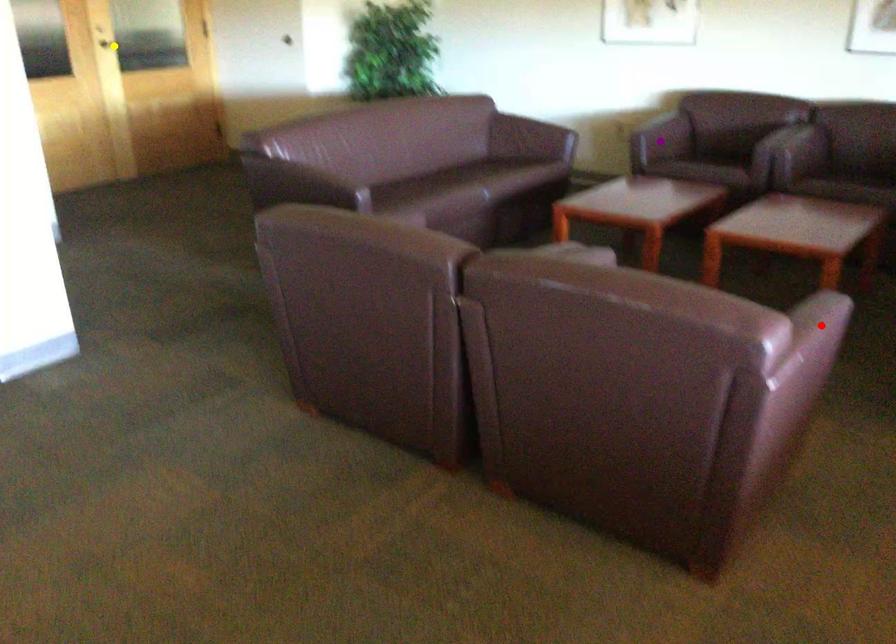
Order these from nearest to farthest:
- red point
- purple point
- yellow point

red point < purple point < yellow point